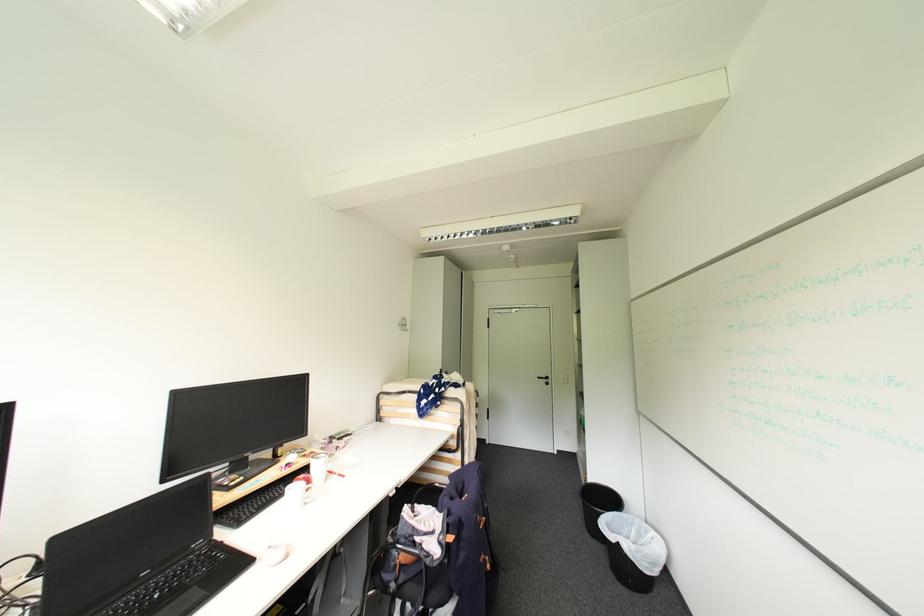
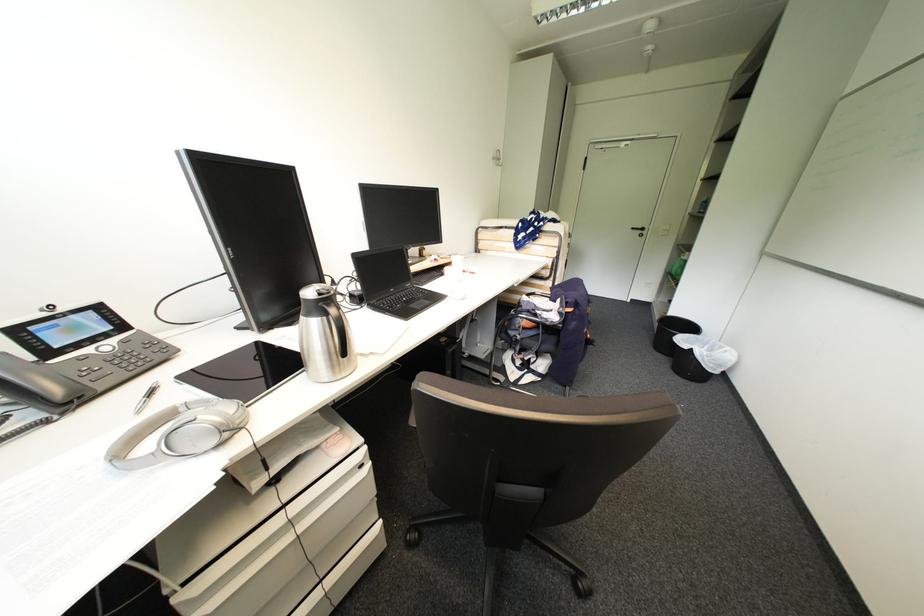
Question: Based on the continuous images, in which direction is the camera rotating? Reply with the corresponding letter.

Choices:
 (A) Left
 (B) Right
 (C) Up
 (D) Down

Answer: (D)